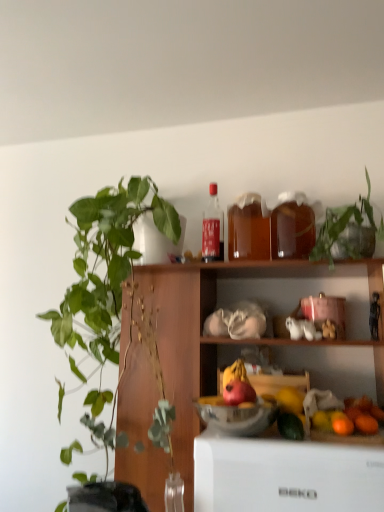
Question: Can you confirm if green leafy plant at upper right, which appears as the 2th houseplant when viewed from the left, is bigger than red matte apple at center?

Choices:
 (A) yes
 (B) no

Answer: (A)

Question: From the image's perspective, is green leafy plant at upper right, which appears as the 2th houseplant when viewed from the left, on red matte apple at center?

Choices:
 (A) no
 (B) yes

Answer: (B)

Question: Is the position of green leafy plant at upper right, which appears as the 2th houseplant when viewed from the left, less distant than that of red matte apple at center?

Choices:
 (A) yes
 (B) no

Answer: (A)

Question: Is green leafy plant at upper right, which appears as the 2th houseplant when viewed from the left, surrounding red matte apple at center?

Choices:
 (A) no
 (B) yes

Answer: (A)

Question: Is green leafy plant at upper right, which is the 1th houseplant in right-to-left order, positioned far away from red matte apple at center?

Choices:
 (A) no
 (B) yes

Answer: (A)

Question: From a real-world perspective, is green leafy plant at upper right, which is the 1th houseplant in right-to-left order, positioned above or below matte glass bottle at upper center, arranged as the 3th bottle when viewed from the right?

Choices:
 (A) below
 (B) above

Answer: (A)

Question: Is green leafy plant at upper right, which appears as the 2th houseplant when viewed from the left, inside or outside of matte glass bottle at upper center, arranged as the 3th bottle when viewed from the right?

Choices:
 (A) inside
 (B) outside

Answer: (B)

Question: Considering their positions, is green leafy plant at upper right, which appears as the 2th houseplant when viewed from the left, located in front of or behind matte glass bottle at upper center, arranged as the 3th bottle when viewed from the right?

Choices:
 (A) behind
 (B) front

Answer: (B)

Question: Is green leafy plant at upper right, which appears as the 2th houseplant when viewed from the left, bigger or smaller than matte glass bottle at upper center, arranged as the 3th bottle when viewed from the right?

Choices:
 (A) small
 (B) big

Answer: (B)

Question: Choose the correct answer: Is matte glass bottle at upper center, arranged as the 3th bottle when viewed from the right, inside translucent glass bottle at upper center, arranged as the 2th bottle when viewed from the right, or outside it?

Choices:
 (A) outside
 (B) inside

Answer: (A)

Question: From a real-world perspective, is matte glass bottle at upper center, positioned as the first bottle in left-to-right order, above or below translucent glass bottle at upper center, arranged as the 2th bottle when viewed from the right?

Choices:
 (A) above
 (B) below

Answer: (A)

Question: Considering the positions of point (203, 215) and point (236, 233), is point (203, 215) closer or farther from the camera than point (236, 233)?

Choices:
 (A) farther
 (B) closer

Answer: (A)

Question: Visually, is matte glass bottle at upper center, arranged as the 3th bottle when viewed from the right, positioned to the left or to the right of translucent glass bottle at upper center, arranged as the 2th bottle when viewed from the right?

Choices:
 (A) right
 (B) left

Answer: (B)

Question: In terms of size, does red matte apple at center appear bigger or smaller than green matte avocado at lower center?

Choices:
 (A) big
 (B) small

Answer: (A)

Question: Based on their positions, is red matte apple at center located to the left or right of green matte avocado at lower center?

Choices:
 (A) right
 (B) left

Answer: (B)